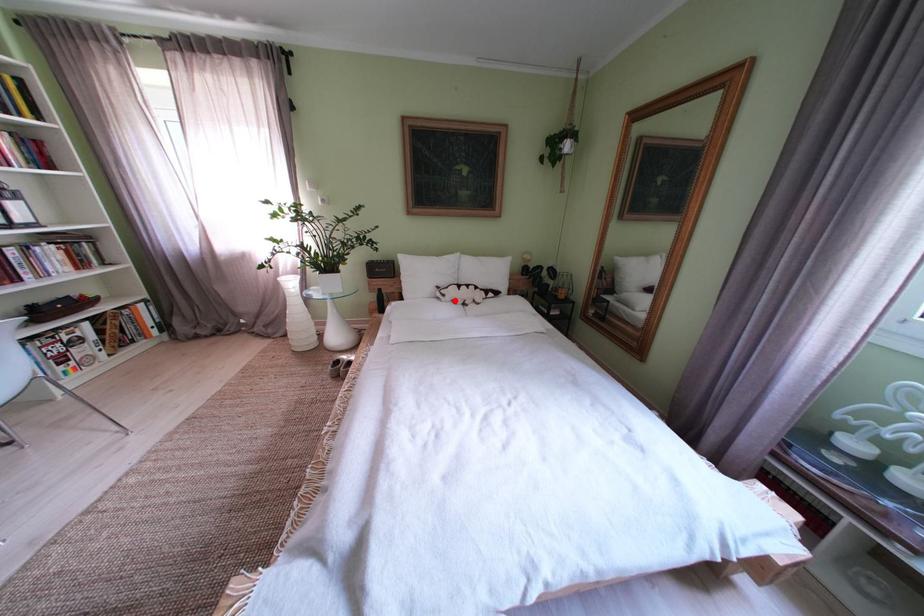
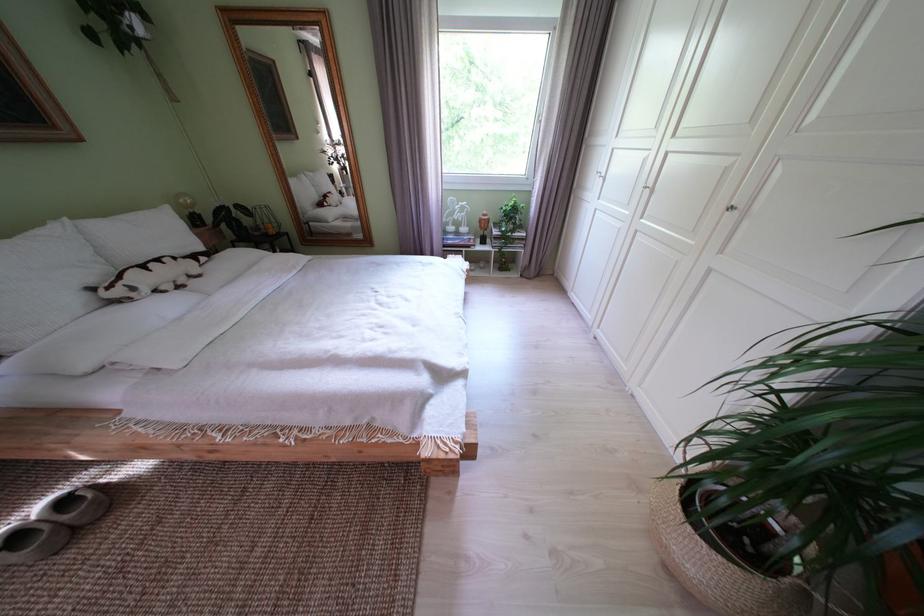
Where in the second image is the point corresponding to the highlighted location from the first image?

(146, 294)